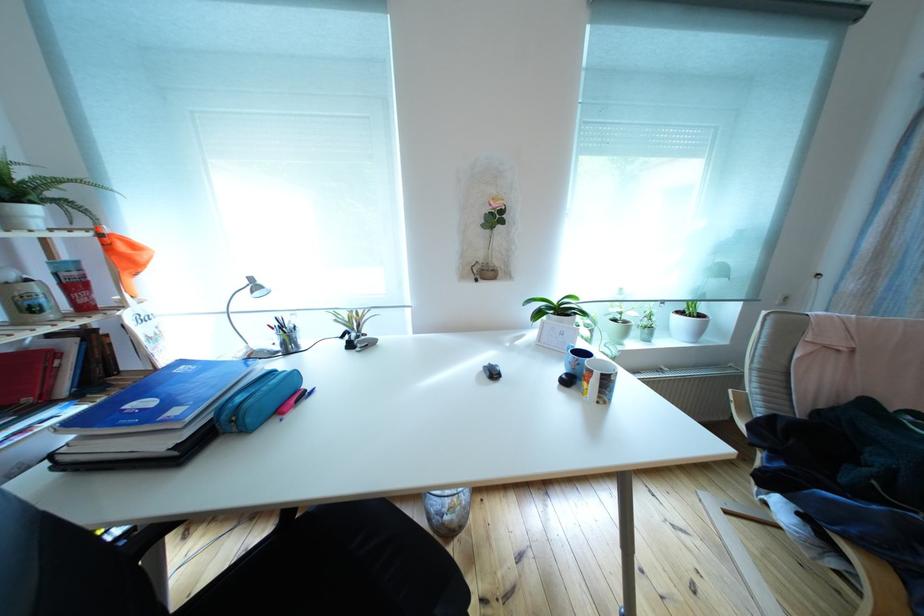
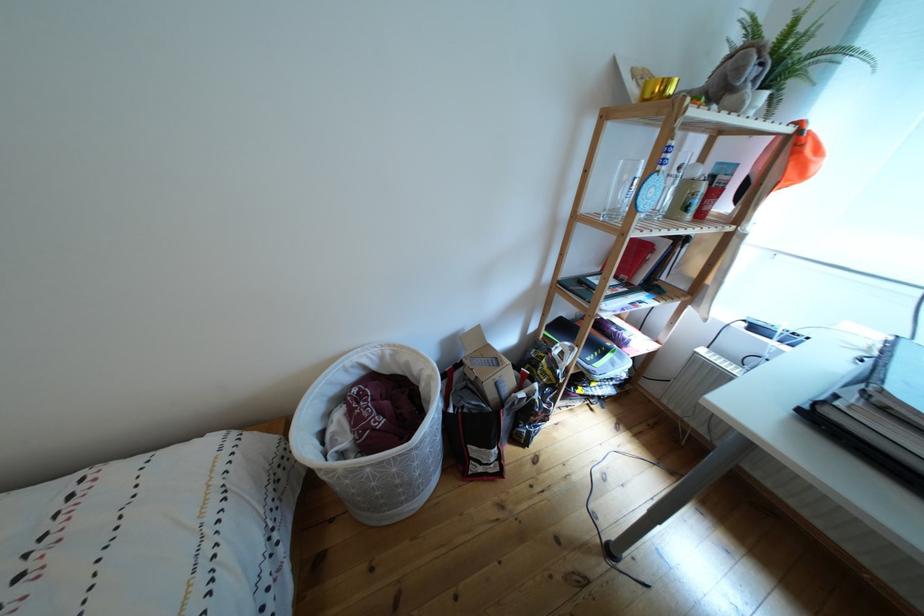
Where in the second image is the point corresponding to [77,455] from the first image?

(849, 408)